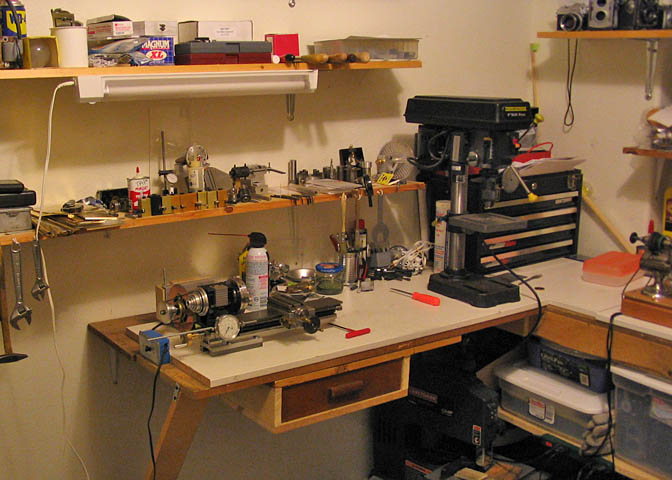
The width and height of the screenshot is (672, 480). In order to click on shelves in this screenshot , I will do `click(56, 76)`, `click(142, 221)`, `click(624, 35)`, `click(654, 152)`.